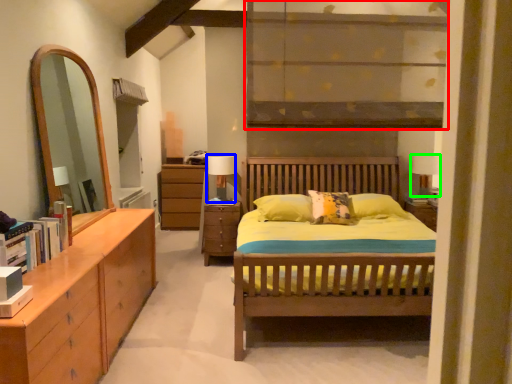
Question: Based on their relative distances, which object is farther from shelf (highlighted by a red box)? Choose from table lamp (highlighted by a blue box) and table lamp (highlighted by a green box).

Choices:
 (A) table lamp
 (B) table lamp

Answer: (B)